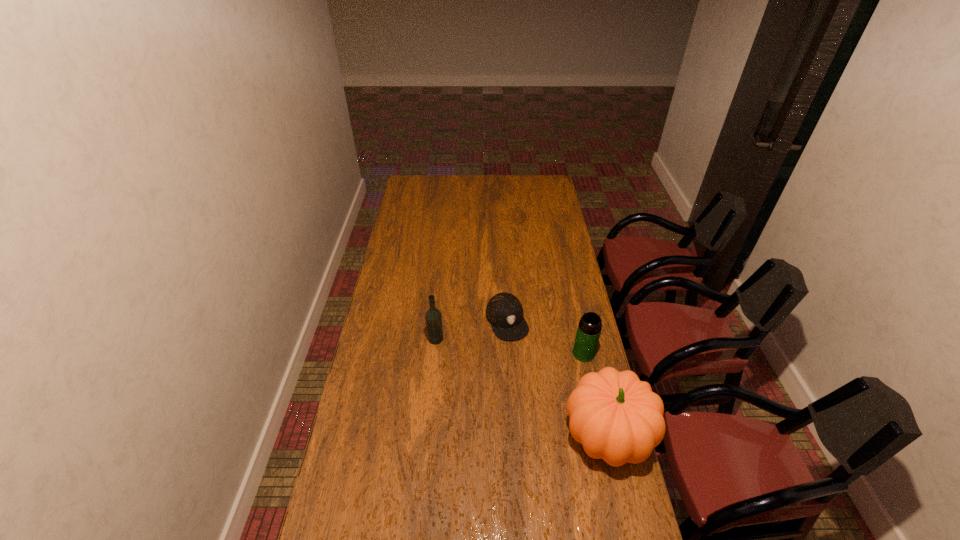
Locate an element on the screen. Image resolution: width=960 pixels, height=540 pixels. vacant space that's between the thermos bottle and the leftmost object is located at coordinates (510, 346).

This screenshot has height=540, width=960. Identify the location of empty space between the leftmost object and the pumpkin. (521, 387).

Locate an element on the screen. The width and height of the screenshot is (960, 540). free space between the shortest object and the leftmost object is located at coordinates (471, 329).

At what (x,y) coordinates should I click in order to perform the action: click on free point between the third object from right to left and the nearest object. Please return your answer as a coordinate pair (x, y). The width and height of the screenshot is (960, 540). Looking at the image, I should click on (558, 378).

Identify the location of vacant space that is in between the nearest object and the shortest object. The width and height of the screenshot is (960, 540). (558, 378).

The width and height of the screenshot is (960, 540). I want to click on the second closest object to the leftmost object, so click(616, 417).

Select which object appears as the third closest to the shortest object. Please provide its 2D coordinates. Your answer should be formatted as a tuple, i.e. [(x, y)], where the tuple contains the x and y coordinates of a point satisfying the conditions above.

[(616, 417)]

Identify the location of vacant space that satisfies the following two spatial constraints: 1. on the front side of the pumpkin; 2. on the left side of the thermos bottle. This screenshot has width=960, height=540. (602, 436).

Where is `free spot that satisfies the following two spatial constraints: 1. on the front side of the thermos bottle; 2. on the right side of the nearest object`? This screenshot has height=540, width=960. free spot that satisfies the following two spatial constraints: 1. on the front side of the thermos bottle; 2. on the right side of the nearest object is located at coordinates (602, 436).

At what (x,y) coordinates should I click in order to perform the action: click on vacant space that satisfies the following two spatial constraints: 1. on the front side of the nearest object; 2. on the right side of the shortest object. Please return your answer as a coordinate pair (x, y). The height and width of the screenshot is (540, 960). Looking at the image, I should click on (514, 436).